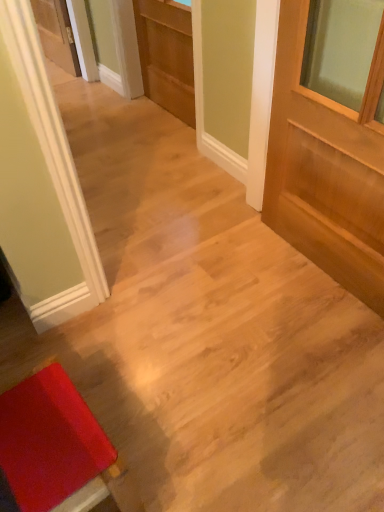
Locate an element on the screen. vacant point above rubberized red stool at lower left (from a real-world perspective) is located at coordinates (46, 438).